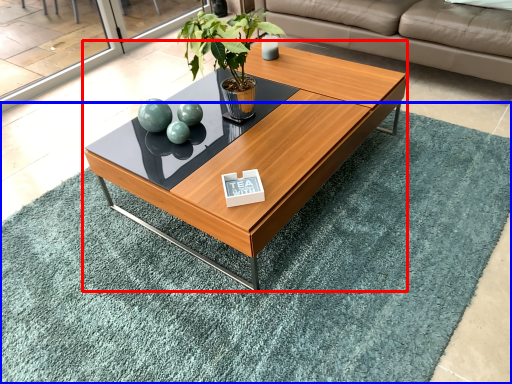
Question: Which point is further to the camera, coffee table (highlighted by a red box) or mat (highlighted by a blue box)?

Choices:
 (A) coffee table
 (B) mat

Answer: (A)